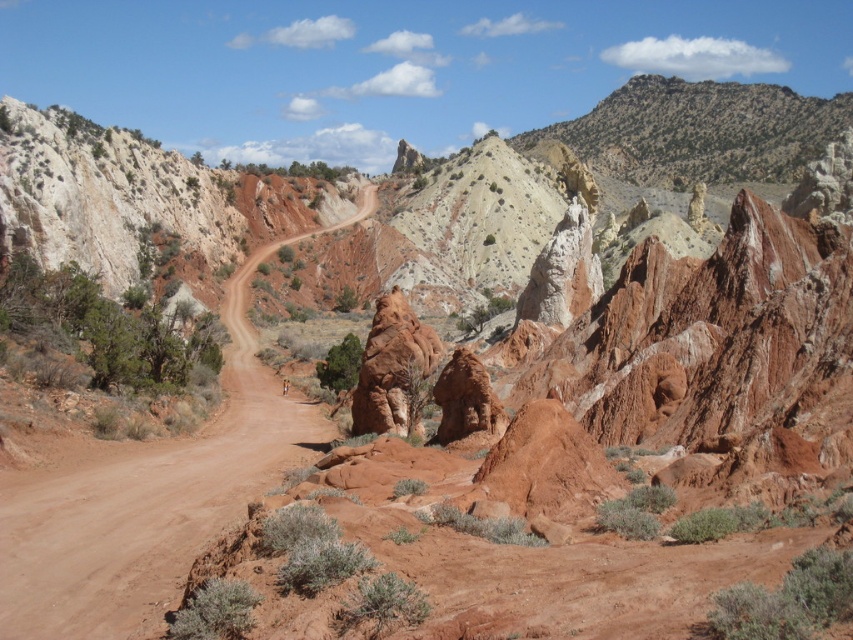
Between dusty dirt road at center and rustic sandstone rock at center, which one has less height?

With less height is rustic sandstone rock at center.

Which is more to the left, dusty dirt road at center or rustic sandstone rock at center?

dusty dirt road at center is more to the left.

Which is behind, point (238, 374) or point (373, 360)?

The point (238, 374) is more distant.

The width and height of the screenshot is (853, 640). Find the location of `dusty dirt road at center`. dusty dirt road at center is located at coordinates (149, 497).